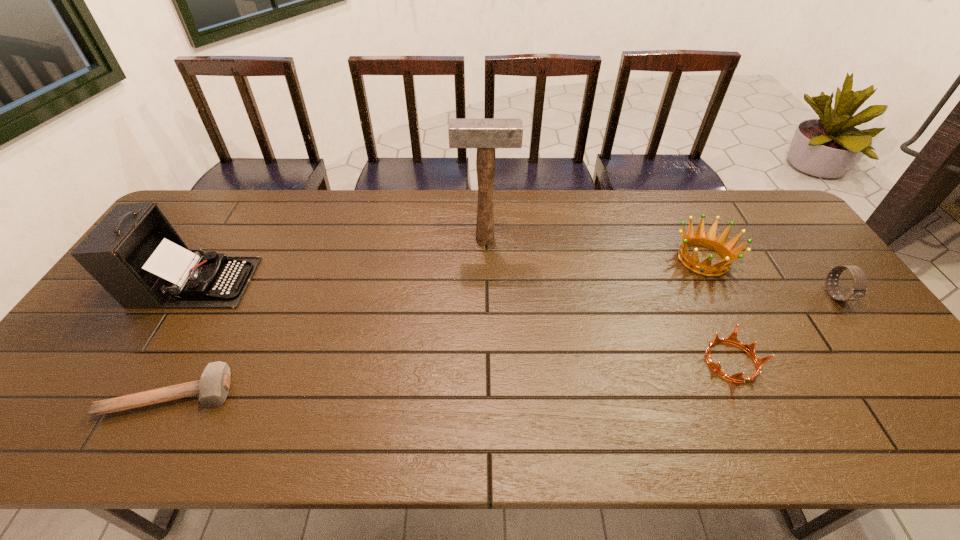
This screenshot has width=960, height=540. What are the coordinates of `free space between the fifth tallest object and the shorter mallet` in the screenshot? It's located at (451, 378).

Locate an element on the screen. free spot between the fifth shortest object and the rightmost object is located at coordinates (516, 289).

Locate an element on the screen. The height and width of the screenshot is (540, 960). free spot between the taller crown and the second tallest object is located at coordinates (449, 271).

Where is `object that is the fourth closest to the taller crown`? object that is the fourth closest to the taller crown is located at coordinates (213, 387).

Where is `object that is the fourth nearest to the watch`? This screenshot has width=960, height=540. object that is the fourth nearest to the watch is located at coordinates (213, 387).

You are a GUI agent. You are given a task and a screenshot of the screen. Output one action in this format:
    pyautogui.click(x=<x>, y=<y>)
    Task: Click on the free spot that satisfies the following two spatial constraints: 1. on the back side of the shorter mallet; 2. inside the open case of the typewriter
    
    Given the screenshot: What is the action you would take?
    pyautogui.click(x=231, y=282)

At what (x,y) coordinates should I click in order to perform the action: click on vacant space that satisfies the following two spatial constraints: 1. inside the open case of the nearer crown; 2. on the right side of the typewriter. Please return your answer as a coordinate pair (x, y). Looking at the image, I should click on (146, 362).

Where is `free space that satisfies the following two spatial constraints: 1. on the front side of the farther mallet; 2. on the left side of the farther crown`? The width and height of the screenshot is (960, 540). free space that satisfies the following two spatial constraints: 1. on the front side of the farther mallet; 2. on the left side of the farther crown is located at coordinates (485, 259).

Locate an element on the screen. vacant area in the image that satisfies the following two spatial constraints: 1. on the back side of the farther crown; 2. on the left side of the nearer crown is located at coordinates (684, 259).